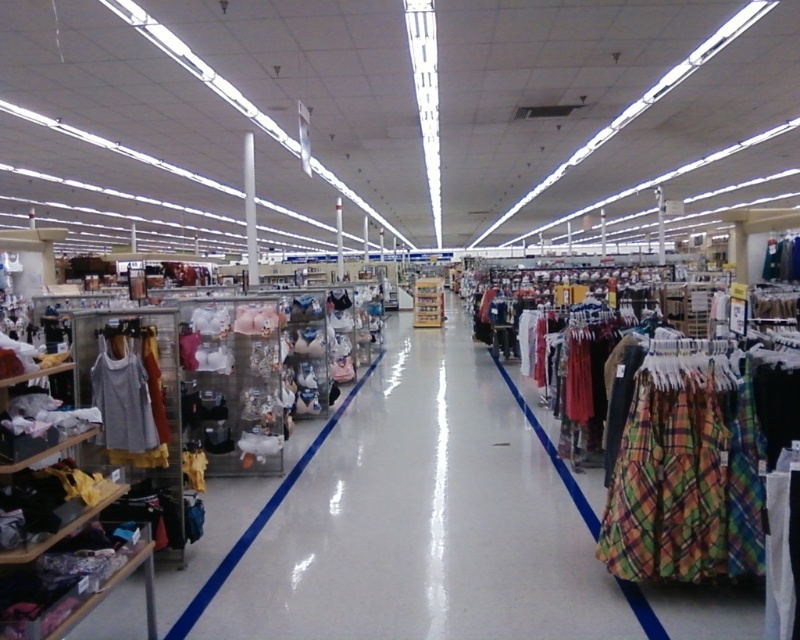
Which is in front, point (390, 410) or point (154, 428)?

Point (154, 428) is more forward.

Find the location of a particular element. Image resolution: width=800 pixels, height=640 pixels. clear plastic bins at center is located at coordinates (404, 518).

Where is `clear plastic bins at center`? clear plastic bins at center is located at coordinates (404, 518).